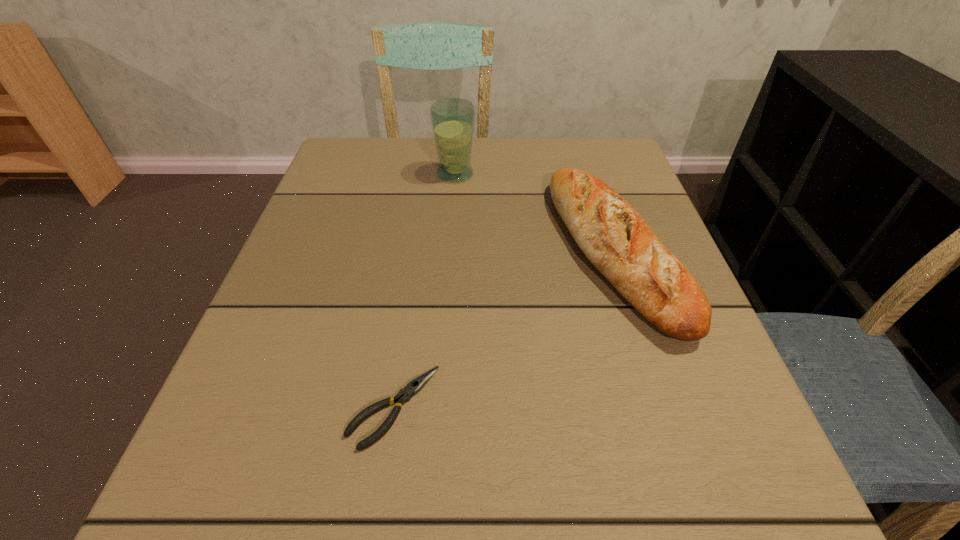
In order to click on unoccupied position between the baguet and the glass in this screenshot , I will do `click(535, 213)`.

Where is `vacant area between the shortest object and the second shortest object`? This screenshot has height=540, width=960. vacant area between the shortest object and the second shortest object is located at coordinates (504, 329).

In order to click on free space that is in between the rightmost object and the tallest object in this screenshot , I will do `click(535, 213)`.

The image size is (960, 540). I want to click on free space between the pliers and the glass, so click(424, 291).

This screenshot has height=540, width=960. In order to click on vacant region between the glass and the nearest object in this screenshot , I will do `click(424, 291)`.

Locate an element on the screen. This screenshot has width=960, height=540. free point between the nearest object and the tallest object is located at coordinates pyautogui.click(x=424, y=291).

At what (x,y) coordinates should I click in order to perform the action: click on vacant space that is in between the second tallest object and the tallest object. Please return your answer as a coordinate pair (x, y). Looking at the image, I should click on (535, 213).

Locate an element on the screen. The width and height of the screenshot is (960, 540). free spot between the rightmost object and the nearest object is located at coordinates (504, 329).

Locate an element on the screen. free area in between the nearest object and the second tallest object is located at coordinates (504, 329).

Image resolution: width=960 pixels, height=540 pixels. Find the location of `free space between the glass and the second shortest object`. free space between the glass and the second shortest object is located at coordinates (535, 213).